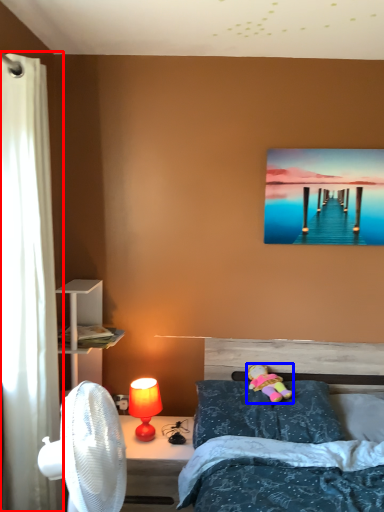
Question: Which object is closer to the camera taking this photo, curtain (highlighted by a red box) or toy (highlighted by a blue box)?

Choices:
 (A) curtain
 (B) toy

Answer: (A)